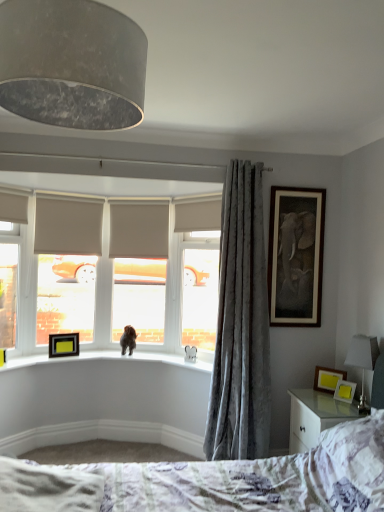
Where is `vacant area located to the right-hand side of brown furry dog at window, which is the 1th animal in left-to-right order`? Image resolution: width=384 pixels, height=512 pixels. vacant area located to the right-hand side of brown furry dog at window, which is the 1th animal in left-to-right order is located at coordinates (145, 357).